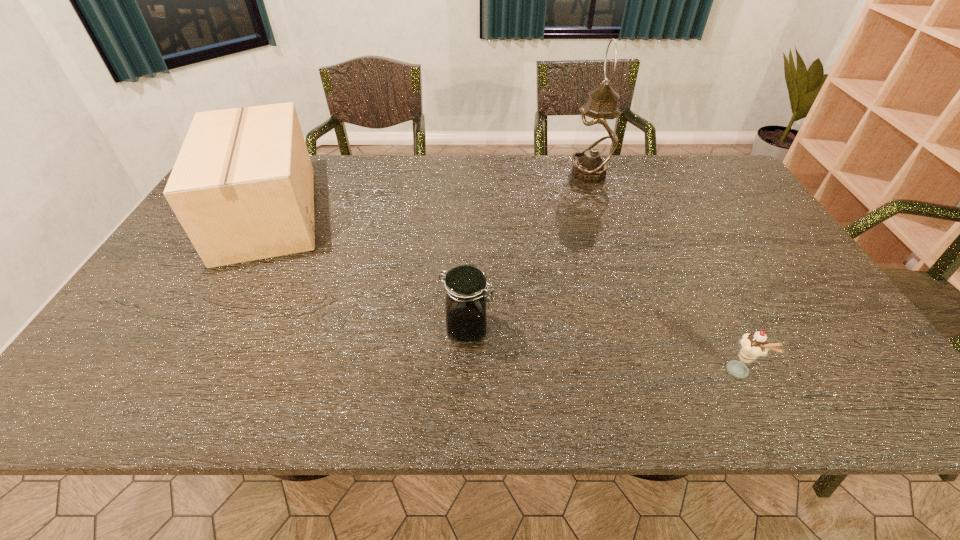
Find the location of `oil lamp`. oil lamp is located at coordinates (596, 139).

Locate an element on the screen. The image size is (960, 540). the third object from left to right is located at coordinates (596, 139).

Where is `box`? This screenshot has height=540, width=960. box is located at coordinates (242, 187).

Image resolution: width=960 pixels, height=540 pixels. What are the coordinates of `the third shortest object` in the screenshot? It's located at (242, 187).

The image size is (960, 540). I want to click on jar, so click(x=466, y=287).

This screenshot has height=540, width=960. I want to click on the third farthest object, so click(466, 287).

I want to click on the rightmost object, so click(755, 345).

Find the location of a particular element. the nearest object is located at coordinates (755, 345).

Where is `free space located 0.060m on the front of the third object from left to right`? This screenshot has height=540, width=960. free space located 0.060m on the front of the third object from left to right is located at coordinates (596, 197).

This screenshot has width=960, height=540. I want to click on vacant space located on the front of the leftmost object, so click(204, 326).